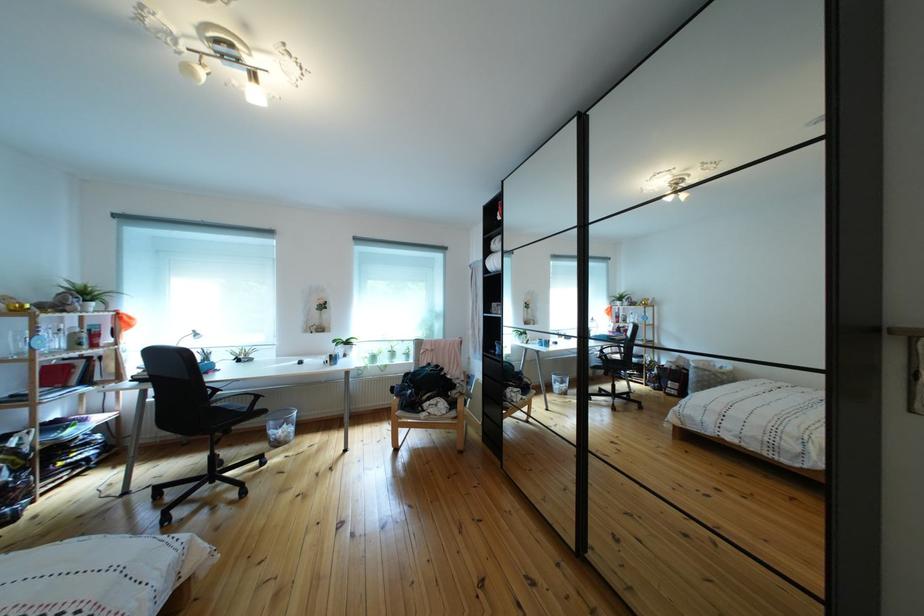
This screenshot has width=924, height=616. I want to click on wooden chair armrest, so click(x=462, y=400).